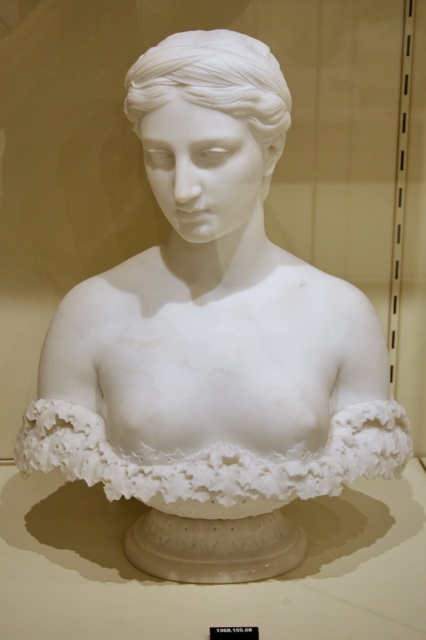
You are an art conservator examining the classical marble sculpture. You notice two elements at the center of the sculpture. One is the white marble ruffle at center, and the other is the white marble bust at center. Which of these two elements is shorter in height?

The white marble ruffle at center has a lesser height compared to the white marble bust at center, so the white marble ruffle at center is shorter in height.

You are an art student observing the classical marble bust sculpture. You notice the white marble ruffle at center and the white marble bust at center. Which object is located to the left of the other?

The white marble ruffle at center is positioned on the left side of white marble bust at center.